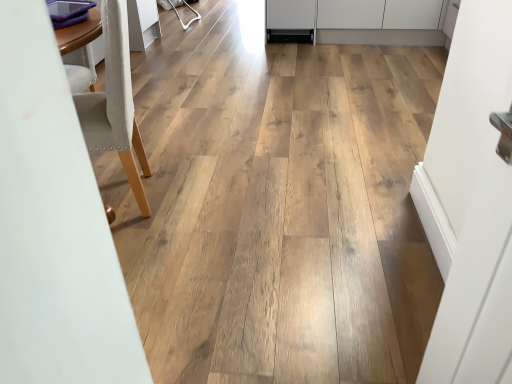
At what (x,y) coordinates should I click in order to perform the action: click on vacant area located to the right-hand side of white fabric chair at left. Please return your answer as a coordinate pair (x, y). Looking at the image, I should click on (201, 195).